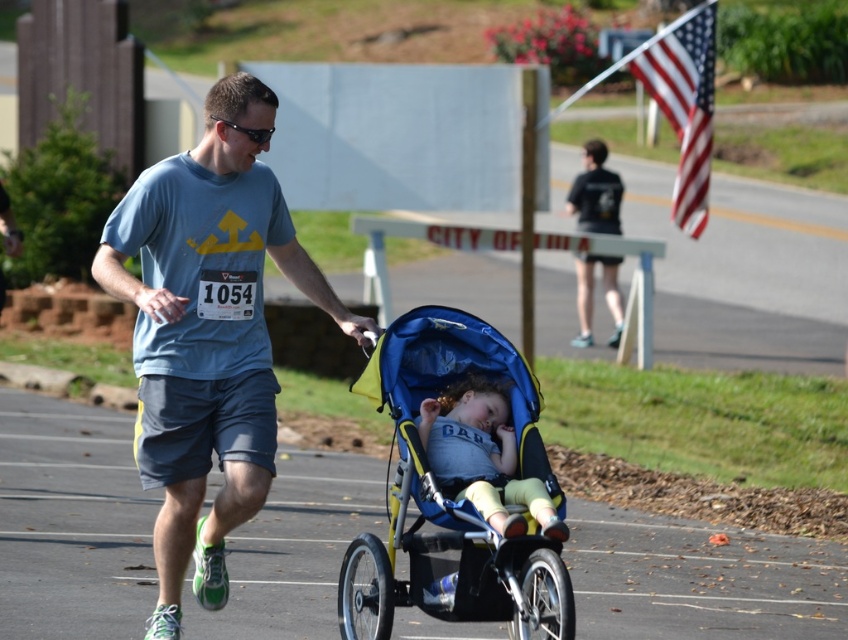
You are a photographer at the race and want to capture a photo of the blue cotton shirt at center and the light blue fabric baby at center. Which one will appear larger in the photo?

The blue cotton shirt at center will appear larger in the photo because it is closer to the viewer than the light blue fabric baby at center.